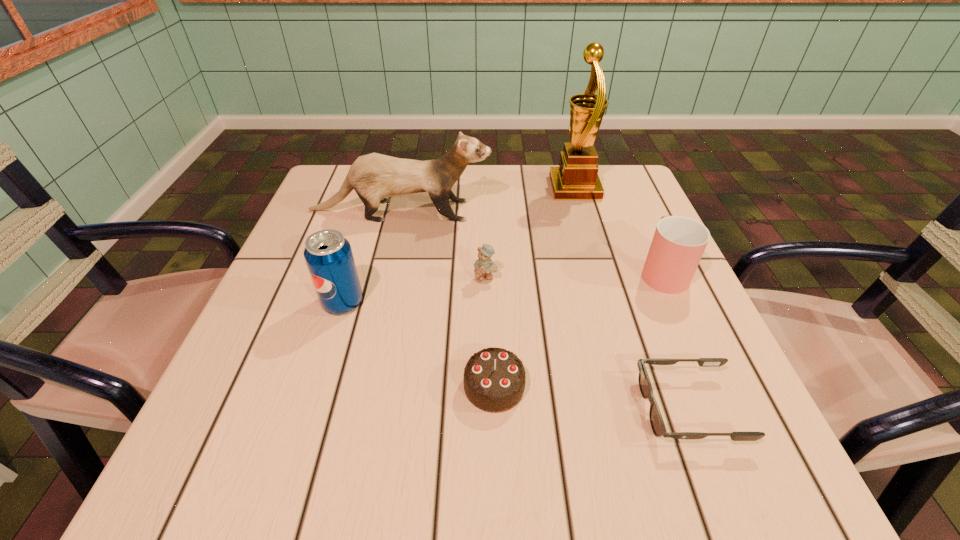
Find the location of a particular element. Image resolution: width=960 pixels, height=540 pixels. free point that satisfies the following two spatial constraints: 1. on the front-facing side of the award; 2. on the front-facing side of the teddy bear is located at coordinates (601, 279).

Image resolution: width=960 pixels, height=540 pixels. In order to click on blank area in the image that satisfies the following two spatial constraints: 1. on the face of the ferret; 2. on the right side of the chocolate cake in this screenshot , I will do `click(360, 386)`.

This screenshot has height=540, width=960. In order to click on free spot that satisfies the following two spatial constraints: 1. on the face of the second tallest object; 2. on the side of the cup with the handle in this screenshot , I will do `click(386, 271)`.

The image size is (960, 540). In order to click on free space that satisfies the following two spatial constraints: 1. on the front-facing side of the tallest object; 2. on the side of the cup with the handle in this screenshot , I will do `click(599, 271)`.